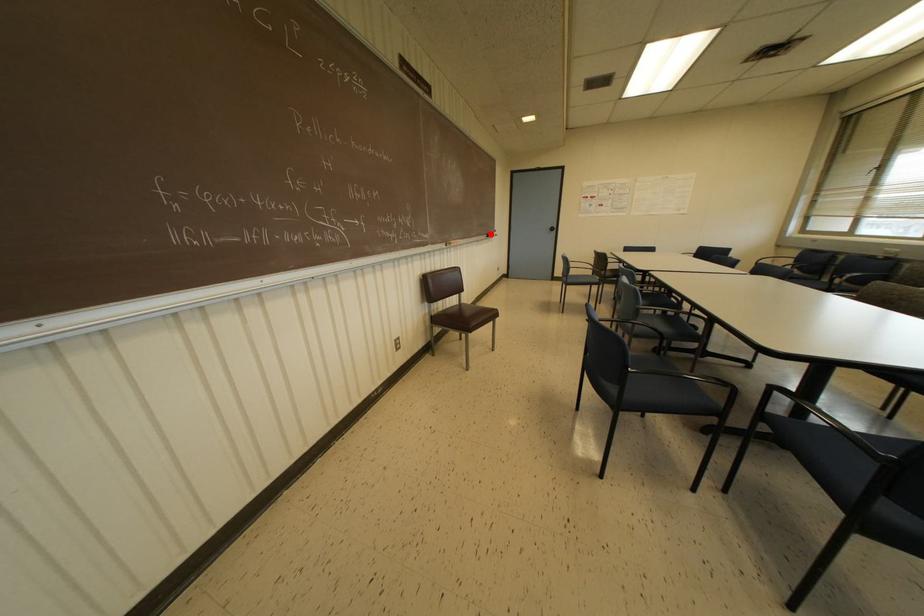
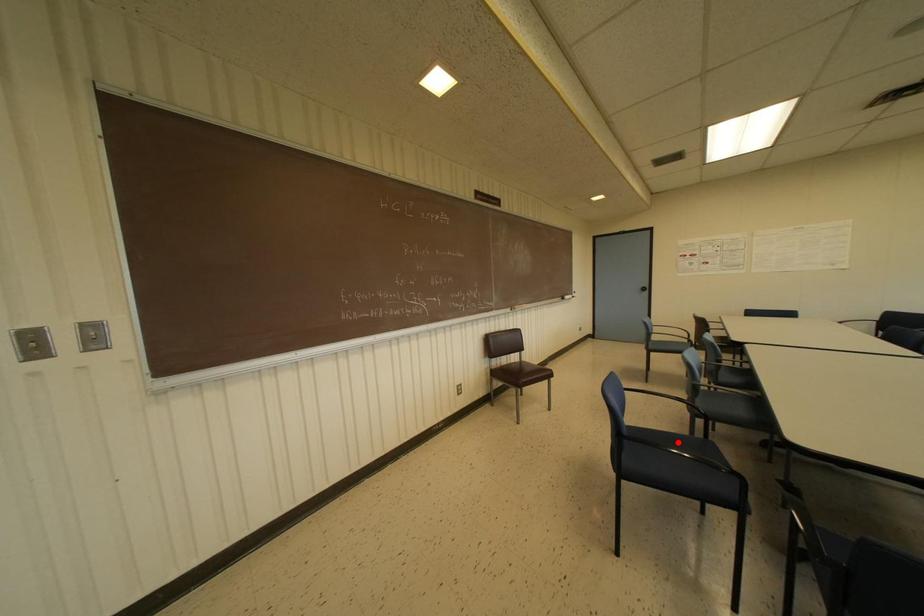
I am providing you with two images of the same scene from different viewpoints. A red point is marked on the first image and another point is marked on the second image. Does the point marked in image1 correspond to the same location as the one in image2?

No